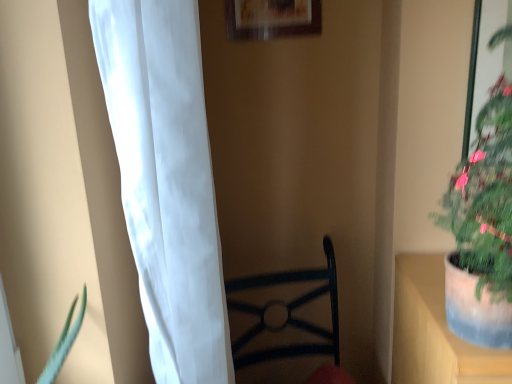
What do you see at coordinates (272, 18) in the screenshot? I see `wooden picture frame at upper center` at bounding box center [272, 18].

Find the location of a particular element. green matte plant at right is located at coordinates (482, 229).

This screenshot has height=384, width=512. I want to click on curtain on the left of wooden picture frame at upper center, so click(166, 181).

Do you think wooden picture frame at upper center is within white sheer curtain at left, or outside of it?

wooden picture frame at upper center is not enclosed by white sheer curtain at left.

In the scene shown: Would you say wooden picture frame at upper center is a long distance from white sheer curtain at left?

No, wooden picture frame at upper center is not far away from white sheer curtain at left.

Does wooden picture frame at upper center have a greater height compared to white sheer curtain at left?

No, wooden picture frame at upper center is not taller than white sheer curtain at left.

Measure the distance between green matte plant at right and white sheer curtain at left.

green matte plant at right and white sheer curtain at left are 19.72 inches apart from each other.

Does point (486, 296) come farther from viewer compared to point (154, 266)?

Yes, it is.

Are green matte plant at right and white sheer curtain at left making contact?

There is a gap between green matte plant at right and white sheer curtain at left.

In the scene shown: Considering the sizes of objects green matte plant at right and white sheer curtain at left in the image provided, who is bigger, green matte plant at right or white sheer curtain at left?

white sheer curtain at left is bigger.

Which object is thinner, white sheer curtain at left or green matte plant at right?

white sheer curtain at left is thinner.

From the image's perspective, is white sheer curtain at left above or below green matte plant at right?

Clearly, from the image's perspective, white sheer curtain at left is below green matte plant at right.

Which is more to the left, white sheer curtain at left or green matte plant at right?

Positioned to the left is white sheer curtain at left.

Based on the photo, measure the distance from white sheer curtain at left to green matte plant at right.

white sheer curtain at left and green matte plant at right are 19.72 inches apart.

Considering the points (209, 287) and (245, 24), which point is behind, point (209, 287) or point (245, 24)?

The point (245, 24) is more distant.

Consider the image. From the image's perspective, is white sheer curtain at left on wooden picture frame at upper center?

No, from the image's perspective, white sheer curtain at left is not on top of wooden picture frame at upper center.

Can you confirm if white sheer curtain at left is taller than wooden picture frame at upper center?

Correct, white sheer curtain at left is much taller as wooden picture frame at upper center.

Consider the image. Would you say green matte plant at right contains wooden picture frame at upper center?

No, wooden picture frame at upper center is not inside green matte plant at right.

Considering the sizes of green matte plant at right and wooden picture frame at upper center in the image, is green matte plant at right bigger or smaller than wooden picture frame at upper center?

Considering their sizes, green matte plant at right takes up more space than wooden picture frame at upper center.

From the picture: Is the position of green matte plant at right less distant than that of wooden picture frame at upper center?

Yes, green matte plant at right is closer to the viewer.

Does point (457, 328) come in front of point (290, 2)?

Yes, it is.

Based on the photo, what's the angular difference between wooden picture frame at upper center and green matte plant at right's facing directions?

0.0104 degrees.

Between wooden picture frame at upper center and green matte plant at right, which one has smaller width?

wooden picture frame at upper center.

Considering the positions of objects wooden picture frame at upper center and green matte plant at right in the image provided, who is in front, wooden picture frame at upper center or green matte plant at right?

Positioned in front is green matte plant at right.

Is wooden picture frame at upper center with green matte plant at right?

No, wooden picture frame at upper center is not next to green matte plant at right.

This screenshot has width=512, height=384. Find the location of `picture frame on the right side of white sheer curtain at left`. picture frame on the right side of white sheer curtain at left is located at coordinates (272, 18).

In the image, there is a green matte plant at right. Identify the location of curtain below it (from a real-world perspective). (166, 181).

From the image, which object appears to be farther from white sheer curtain at left, wooden picture frame at upper center or green matte plant at right?

wooden picture frame at upper center is positioned further to the anchor white sheer curtain at left.

From the image, which object appears to be farther from white sheer curtain at left, green matte plant at right or wooden picture frame at upper center?

wooden picture frame at upper center is further to white sheer curtain at left.

Which object lies nearer to the anchor point wooden picture frame at upper center, white sheer curtain at left or green matte plant at right?

Based on the image, green matte plant at right appears to be nearer to wooden picture frame at upper center.

Based on their spatial positions, is wooden picture frame at upper center or white sheer curtain at left further from green matte plant at right?

wooden picture frame at upper center.

Estimate the real-world distances between objects in this image. Which object is further from wooden picture frame at upper center, green matte plant at right or white sheer curtain at left?

white sheer curtain at left.

Looking at the image, which one is located closer to green matte plant at right, white sheer curtain at left or wooden picture frame at upper center?

white sheer curtain at left.

Where is `curtain between green matte plant at right and wooden picture frame at upper center along the z-axis`? The image size is (512, 384). curtain between green matte plant at right and wooden picture frame at upper center along the z-axis is located at coordinates (166, 181).